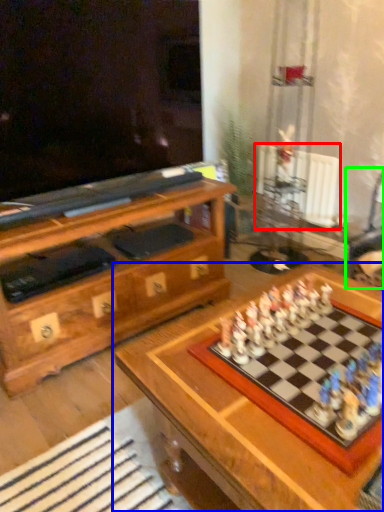
Question: Which object is positioned closest to radiator (highlighted by a red box)? Select from table (highlighted by a blue box) and swivel chair (highlighted by a green box).

Choices:
 (A) table
 (B) swivel chair

Answer: (B)